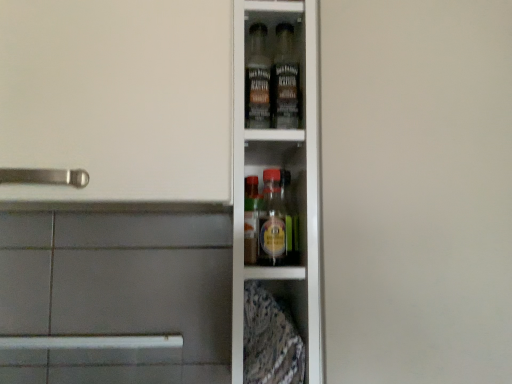
In the scene shown: In order to face transparent glass cabinet at center, should I rotate leftwards or rightwards?

To align with it, rotate right about 16.011°.

What do you see at coordinates (417, 190) in the screenshot? The height and width of the screenshot is (384, 512). I see `transparent glass cabinet at center` at bounding box center [417, 190].

I want to click on transparent glass cabinet at center, so click(417, 190).

This screenshot has height=384, width=512. In order to click on clear glass bottles at center in this screenshot , I will do `click(166, 249)`.

What do you see at coordinates (166, 249) in the screenshot? I see `clear glass bottles at center` at bounding box center [166, 249].

Measure the distance between point (41, 357) and camera.

Point (41, 357) and camera are 36.30 inches apart from each other.

Find the location of a particular element. transparent glass cabinet at center is located at coordinates (417, 190).

From the picture: Can you confirm if clear glass bottles at center is positioned to the right of transparent glass cabinet at center?

In fact, clear glass bottles at center is to the left of transparent glass cabinet at center.

Is clear glass bottles at center behind transparent glass cabinet at center?

Yes, it is behind transparent glass cabinet at center.

Based on the photo, which point is more forward, (257, 15) or (383, 38)?

The point (383, 38) is in front.

From the image's perspective, who appears lower, clear glass bottles at center or transparent glass cabinet at center?

From the image's view, clear glass bottles at center is below.

From a real-world perspective, is clear glass bottles at center located higher than transparent glass cabinet at center?

Actually, clear glass bottles at center is physically below transparent glass cabinet at center in the real world.

Considering the relative sizes of clear glass bottles at center and transparent glass cabinet at center in the image provided, is clear glass bottles at center thinner than transparent glass cabinet at center?

No, clear glass bottles at center is not thinner than transparent glass cabinet at center.

Considering the sizes of objects clear glass bottles at center and transparent glass cabinet at center in the image provided, who is taller, clear glass bottles at center or transparent glass cabinet at center?

transparent glass cabinet at center is taller.

Between clear glass bottles at center and transparent glass cabinet at center, which one has smaller size?

With smaller size is transparent glass cabinet at center.

Is clear glass bottles at center surrounding transparent glass cabinet at center?

No, transparent glass cabinet at center is located outside of clear glass bottles at center.

In the scene shown: Are clear glass bottles at center and transparent glass cabinet at center far apart?

clear glass bottles at center is actually quite close to transparent glass cabinet at center.

Could you tell me if clear glass bottles at center is turned towards transparent glass cabinet at center?

No.

How many degrees apart are the facing directions of clear glass bottles at center and transparent glass cabinet at center?

They differ by 45.4 degrees in their facing directions.

I want to click on screen door lying above the clear glass bottles at center (from the image's perspective), so click(417, 190).

In the image, is transparent glass cabinet at center on the left side or the right side of clear glass bottles at center?

Based on their positions, transparent glass cabinet at center is located to the right of clear glass bottles at center.

Is transparent glass cabinet at center closer to the viewer compared to clear glass bottles at center?

Yes, transparent glass cabinet at center is in front of clear glass bottles at center.

Does point (420, 114) come closer to viewer compared to point (133, 338)?

Yes, it is.

From the image's perspective, which object appears higher, transparent glass cabinet at center or clear glass bottles at center?

transparent glass cabinet at center.

From a real-world perspective, is transparent glass cabinet at center on top of clear glass bottles at center?

Yes, from a real-world perspective, transparent glass cabinet at center is on top of clear glass bottles at center.

Can you confirm if transparent glass cabinet at center is thinner than clear glass bottles at center?

Yes.

Between transparent glass cabinet at center and clear glass bottles at center, which one has more height?

transparent glass cabinet at center.

Considering the sizes of objects transparent glass cabinet at center and clear glass bottles at center in the image provided, who is smaller, transparent glass cabinet at center or clear glass bottles at center?

transparent glass cabinet at center is smaller.

Based on the photo, can clear glass bottles at center be found inside transparent glass cabinet at center?

No, transparent glass cabinet at center does not contain clear glass bottles at center.

Are transparent glass cabinet at center and clear glass bottles at center located far from each other?

They are positioned close to each other.

Is transparent glass cabinet at center looking in the opposite direction of clear glass bottles at center?

No, transparent glass cabinet at center's orientation is not away from clear glass bottles at center.

Can you tell me how much transparent glass cabinet at center and clear glass bottles at center differ in facing direction?

The angle between the facing direction of transparent glass cabinet at center and the facing direction of clear glass bottles at center is 45.4 degrees.

How far apart are transparent glass cabinet at center and clear glass bottles at center?

transparent glass cabinet at center and clear glass bottles at center are 24.88 centimeters apart.

Locate an element on the screen. The width and height of the screenshot is (512, 384). screen door that is above the clear glass bottles at center (from a real-world perspective) is located at coordinates pos(417,190).

I want to click on shelf behind the transparent glass cabinet at center, so click(x=166, y=249).

You are a GUI agent. You are given a task and a screenshot of the screen. Output one action in this format:
    pyautogui.click(x=<x>, y=<y>)
    Task: Click on the shelf that appears on the left of transparent glass cabinet at center
    The image size is (512, 384).
    Given the screenshot: What is the action you would take?
    pyautogui.click(x=166, y=249)